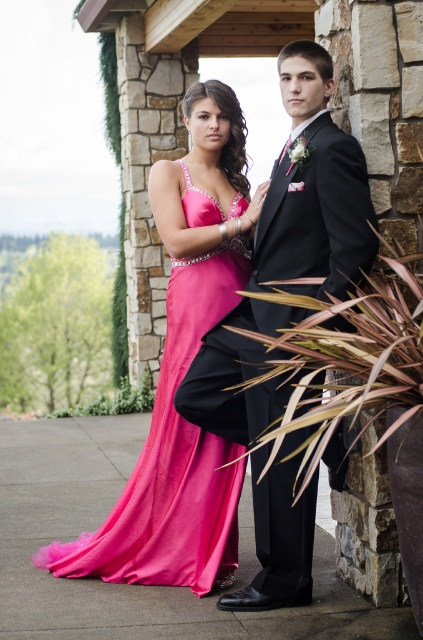
You are a photographer setting up for a couple portrait. The scene requires the couple to stand side by side with the shiny black suit at center and the shiny satin gown at center. Based on their heights, which one should be positioned slightly behind to ensure both are visible in the frame?

The shiny black suit at center is much taller than the shiny satin gown at center, so positioning the shiny black suit at center slightly behind would ensure both are visible in the frame.

You are a photographer setting up for a prom photo shoot. You have two main subjects in the frame, the shiny black suit at center and the shiny satin gown at center. Based on their sizes, which one should you focus on to ensure the composition remains balanced?

The shiny black suit at center has a smaller size compared to the shiny satin gown at center, so focusing on the shiny satin gown at center would help balance the composition since it occupies more visual space.